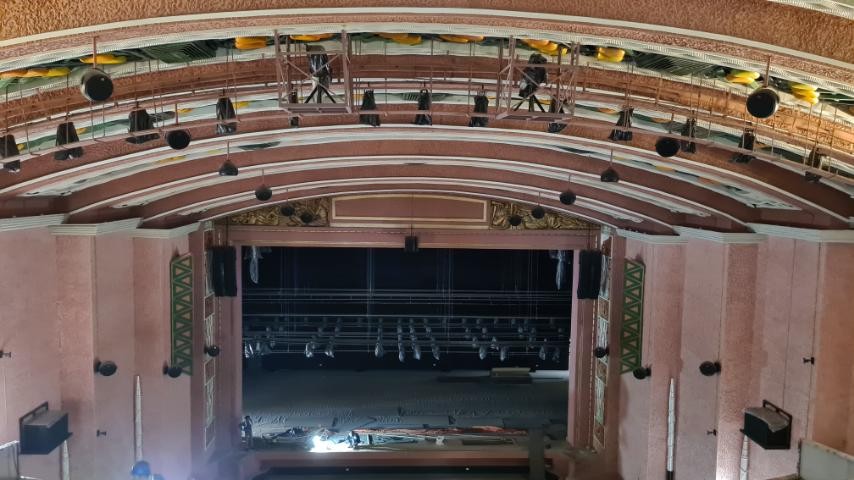
This screenshot has width=854, height=480. I want to click on curving arches, so click(x=646, y=21), click(x=642, y=90), click(x=642, y=141), click(x=635, y=176), click(x=628, y=204), click(x=611, y=219).